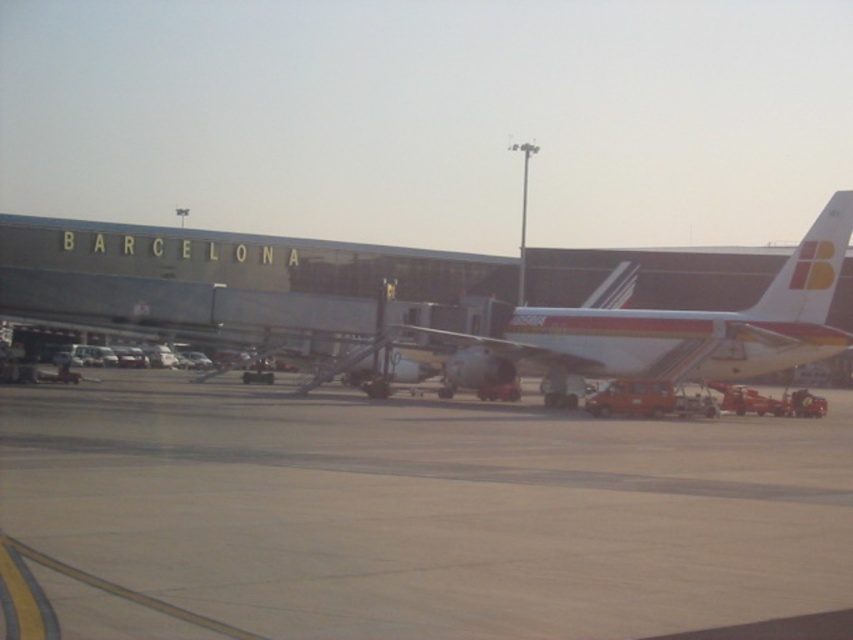
Is brown concrete tarmac at center in front of white glossy airplane at center?

Yes, brown concrete tarmac at center is closer to the viewer.

Identify the location of brown concrete tarmac at center. This screenshot has height=640, width=853. (412, 515).

In order to click on brown concrete tarmac at center in this screenshot , I will do `click(412, 515)`.